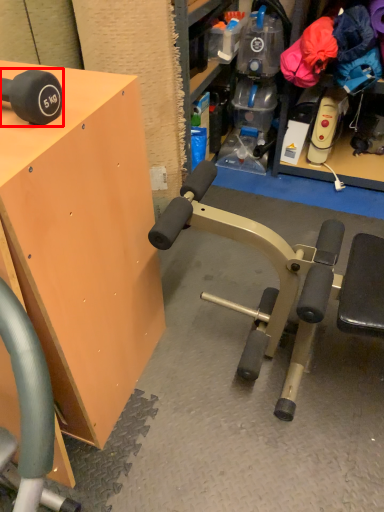
Question: Considering the relative positions of dumbbell (annotated by the red box) and table in the image provided, where is dumbbell (annotated by the red box) located with respect to the staircase?

Choices:
 (A) left
 (B) right

Answer: (B)